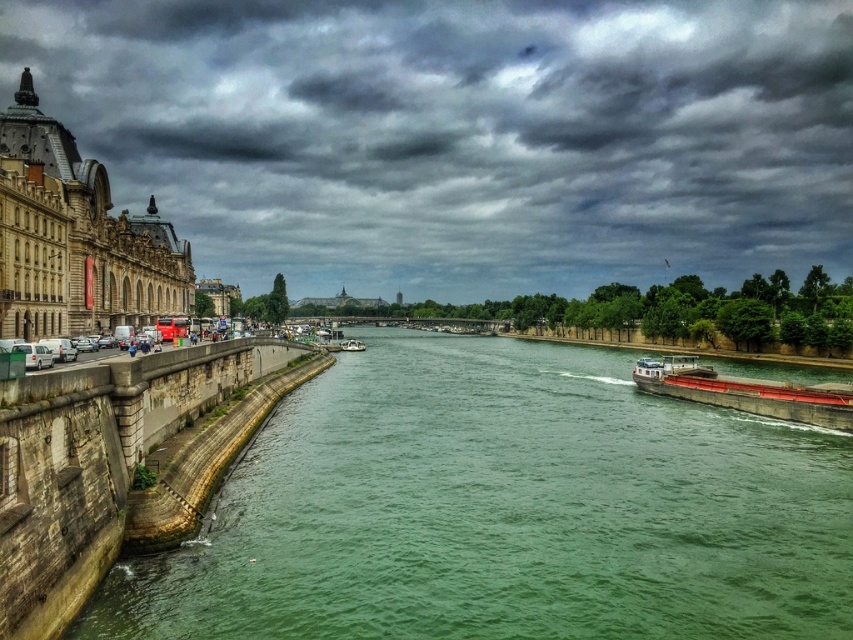
You are an artist planning to paint the scene. You want to ensure the dark gray clouds at upper center and the white plastic boat at center are positioned correctly in terms of depth. Based on the scene, which object should appear in front of the other?

The dark gray clouds at upper center should appear in front of the white plastic boat at center because they are closer to the viewer according to the description.

You are standing at the edge of the river and see two points marked in the image. Which point, point (614, 461) or point (717, 378), is closer to you?

A: Point (614, 461) is closer to the viewer than point (717, 378).

You are an architect designing a new bridge over the green stone river at center. The white plastic boat at center needs to pass under the bridge. Based on the scene description, what is the minimum height the bridge must have to allow the boat to pass safely?

The green stone river at center is much taller than the white plastic boat at center. Therefore, the bridge must be built at least as tall as the green stone river at center to ensure the boat can pass safely under it.